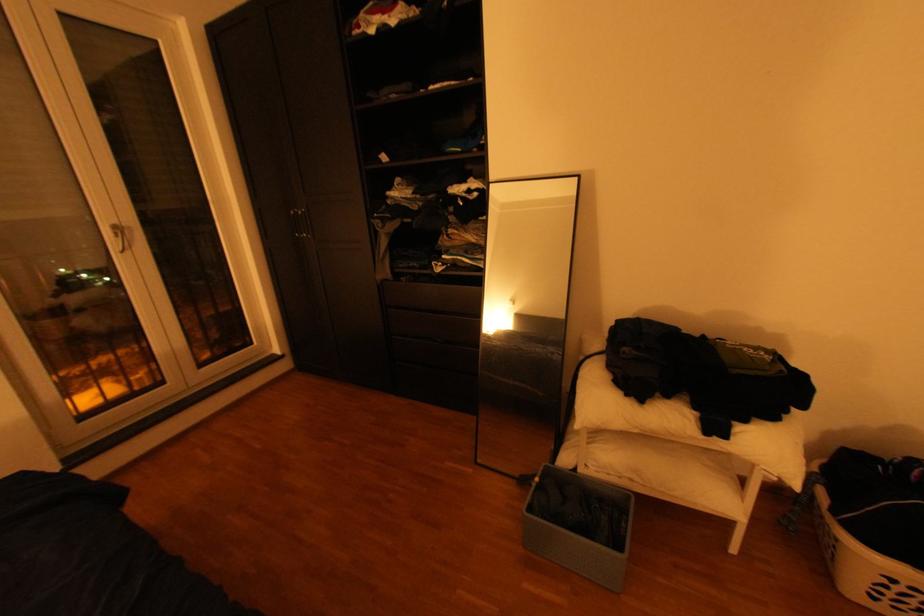
The image size is (924, 616). What do you see at coordinates (119, 237) in the screenshot?
I see `the white door handle` at bounding box center [119, 237].